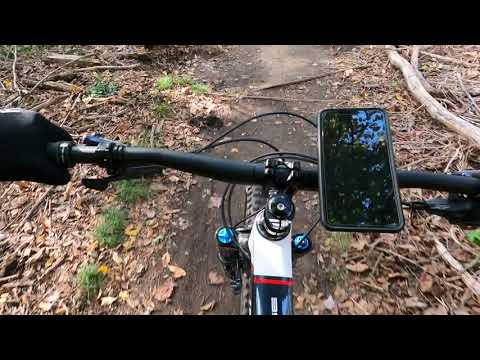
Find the location of a particular element. phone is located at coordinates (358, 209).